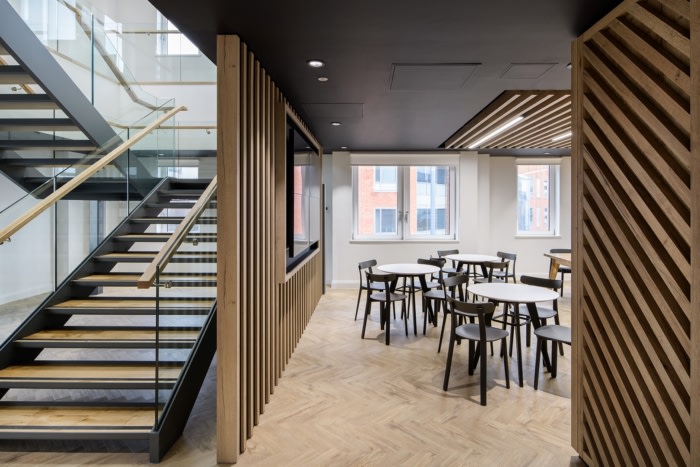
Find the location of a particular element. glass panels on staircase is located at coordinates 22,257, 97,211, 161,148, 117,80, 64,40, 192,298.